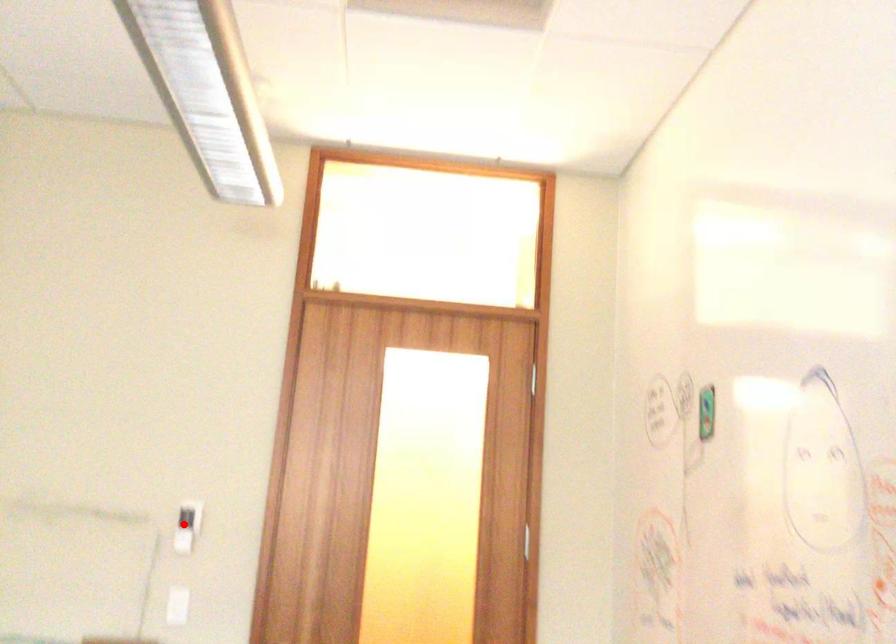
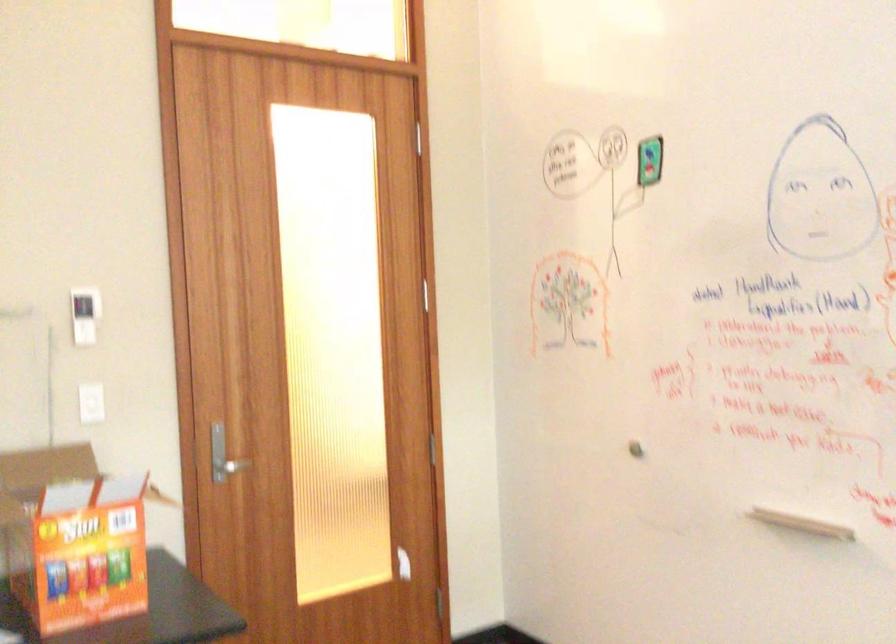
The point at the highlighted location is marked in the first image. Where is the corresponding point in the second image?

(84, 315)